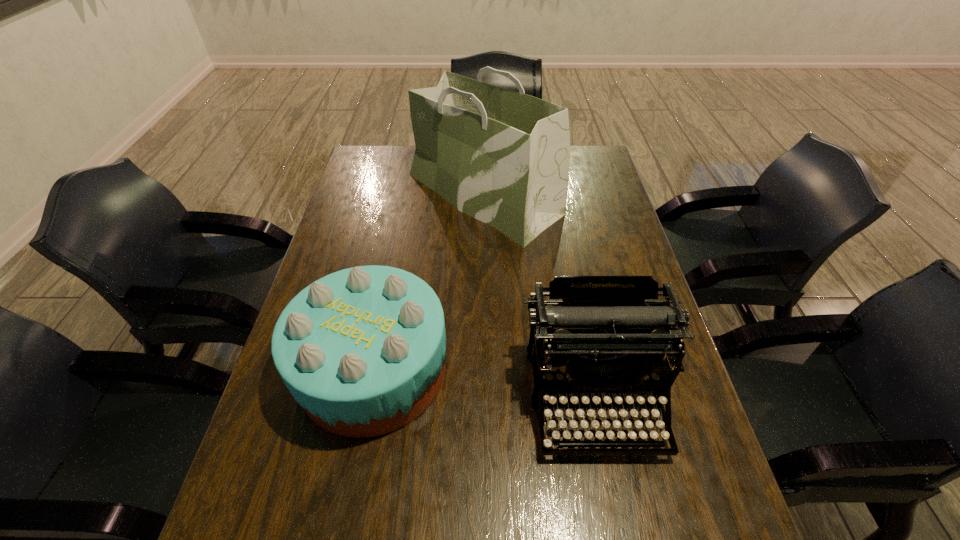
Identify the location of vacant area at the left edge. (376, 228).

This screenshot has width=960, height=540. In the image, there is a desktop. In order to click on vacant space at the right edge in this screenshot , I will do `click(709, 539)`.

This screenshot has width=960, height=540. In the image, there is a desktop. Identify the location of free region at the far left corner. (384, 164).

You are a GUI agent. You are given a task and a screenshot of the screen. Output one action in this format:
    pyautogui.click(x=<x>, y=<y>)
    Task: Click on the vacant space at the far right corner of the desktop
    The height and width of the screenshot is (540, 960).
    Given the screenshot: What is the action you would take?
    pyautogui.click(x=574, y=163)

Find the location of a particular element. This screenshot has height=540, width=960. vacant point located between the cake and the typewriter is located at coordinates (484, 383).

The height and width of the screenshot is (540, 960). I want to click on free space between the cake and the typewriter, so click(484, 383).

Locate which object is the second closest to the typewriter. Please provide its 2D coordinates. Your answer should be formatted as a tuple, i.e. [(x, y)], where the tuple contains the x and y coordinates of a point satisfying the conditions above.

[(502, 157)]

Identify which object is the nearest to the typewriter. Please provide its 2D coordinates. Your answer should be formatted as a tuple, i.e. [(x, y)], where the tuple contains the x and y coordinates of a point satisfying the conditions above.

[(362, 350)]